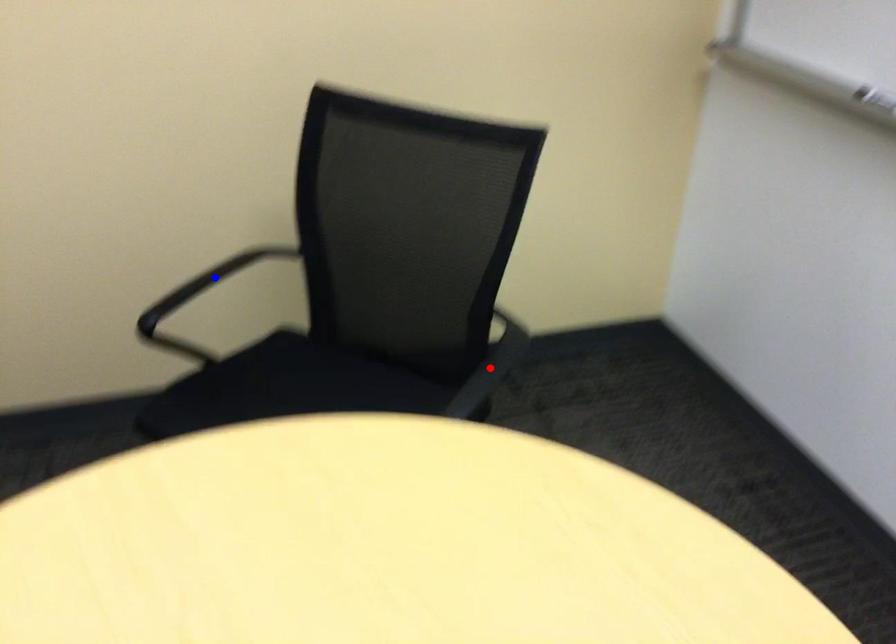
Question: Two points are marked on the image. Which point is closer to the camera?

Choices:
 (A) Blue point is closer.
 (B) Red point is closer.

Answer: (B)